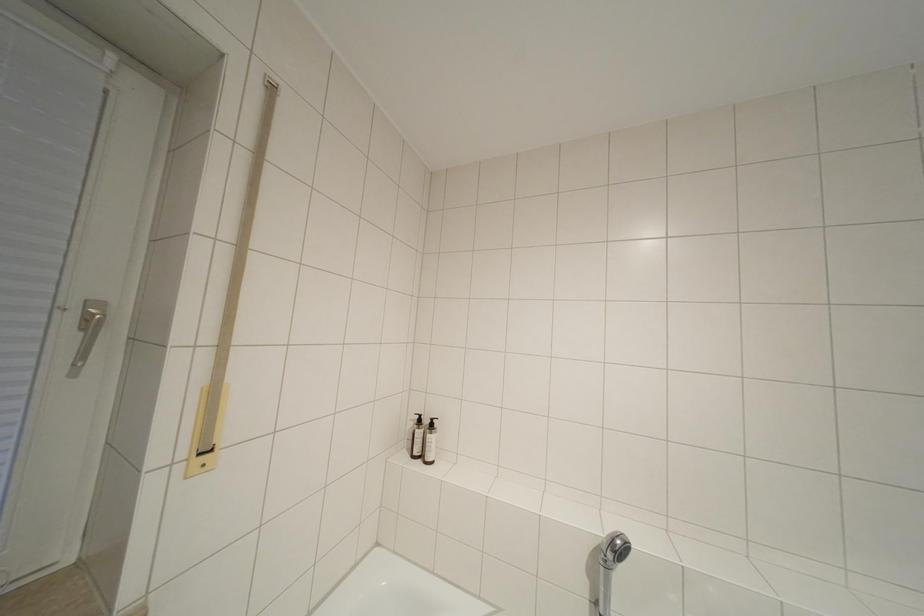
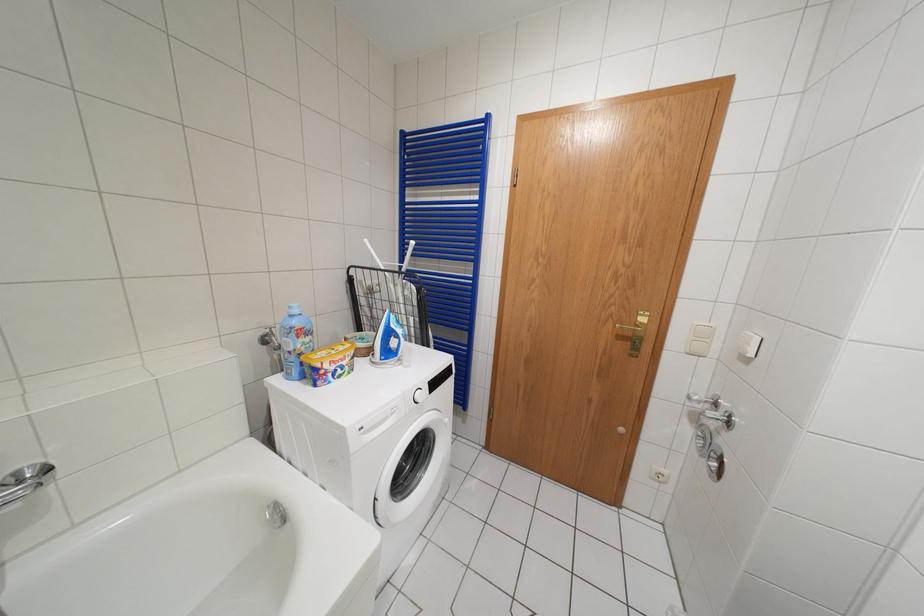
The first image is from the beginning of the video and the second image is from the end. How did the camera likely rotate when shooting the video?

The camera's rotation is toward right-down.